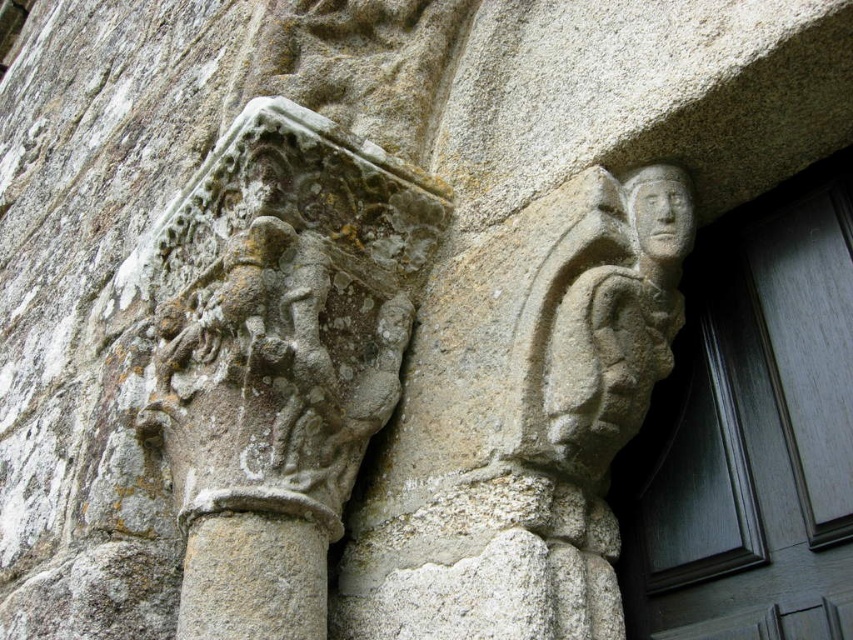
Question: Which point is farther from the camera taking this photo?

Choices:
 (A) (601, 284)
 (B) (193, 387)
 (C) (239, 522)

Answer: (B)

Question: Is gray stone figure at upper right wider than gray stone carving at upper left?

Choices:
 (A) yes
 (B) no

Answer: (B)

Question: Which of these objects is positioned farthest from the gray stone column at center?

Choices:
 (A) gray stone figure at upper right
 (B) gray stone carving at upper left

Answer: (A)

Question: Does gray stone figure at upper right appear over gray stone carving at upper left?

Choices:
 (A) yes
 (B) no

Answer: (B)

Question: Among these objects, which one is farthest from the camera?

Choices:
 (A) gray stone column at center
 (B) gray stone carving at upper left

Answer: (B)

Question: Does gray stone carving at upper left have a greater width compared to gray stone column at center?

Choices:
 (A) yes
 (B) no

Answer: (A)